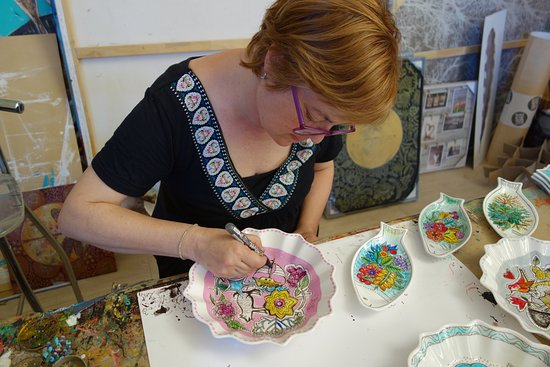
At what (x,y) coordinates should I click in order to perform the action: click on canvas. Please return your answer as a coordinate pair (x, y). The width and height of the screenshot is (550, 367). Looking at the image, I should click on (135, 29).